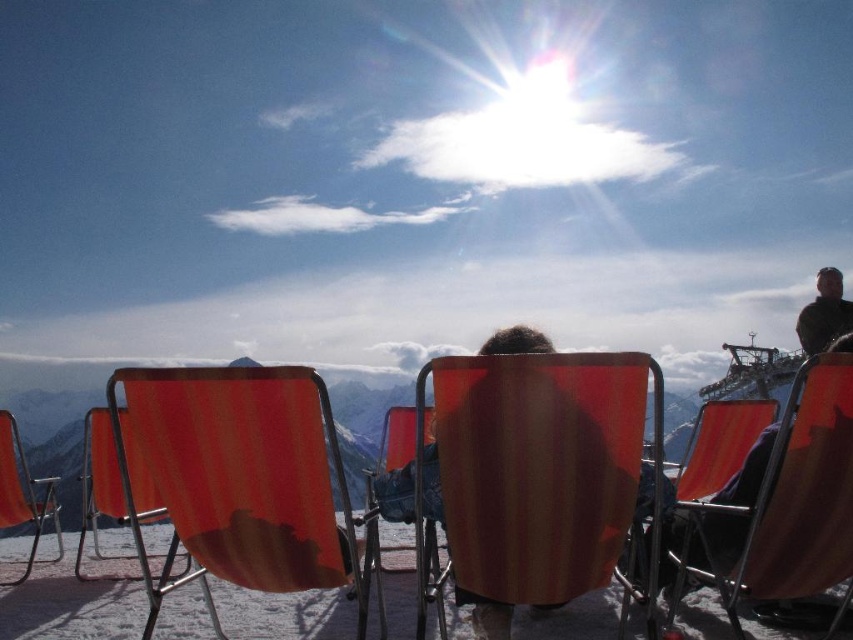
You are standing at the camera position and want to reach the point marked as point (109, 461). If your walking speed is 3 feet per second, how many seconds will it take you to reach that point?

The point (109, 461) is 20.47 feet away from the camera. At a speed of 3 feet per second, it would take approximately 6.82 seconds to reach it.

You are standing at the center of the scene and want to sit down on the matte orange beach chair at center. Based on your position, in which direction should you move to reach the chair?

Since you are already at the center of the scene and the matte orange beach chair at center is located at point (538,467), you are already positioned directly in front of the chair. No movement in a specific direction is needed as you are already at the central point where the chair is situated.

You are standing at the point marked by the coordinate [239,476] in the image. What object are you directly positioned on?

You are directly positioned on the orange fabric beach chair at center marked by the coordinate [239,476].